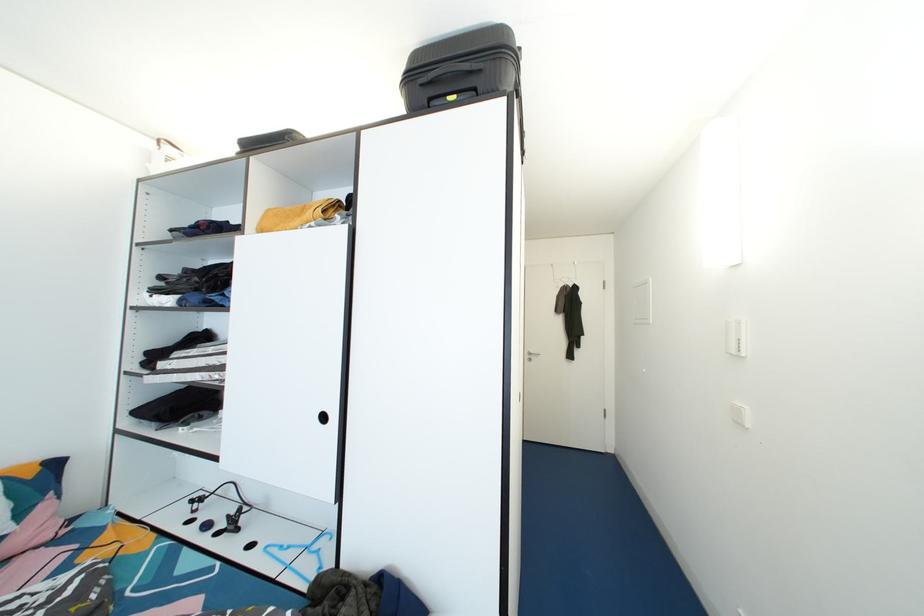
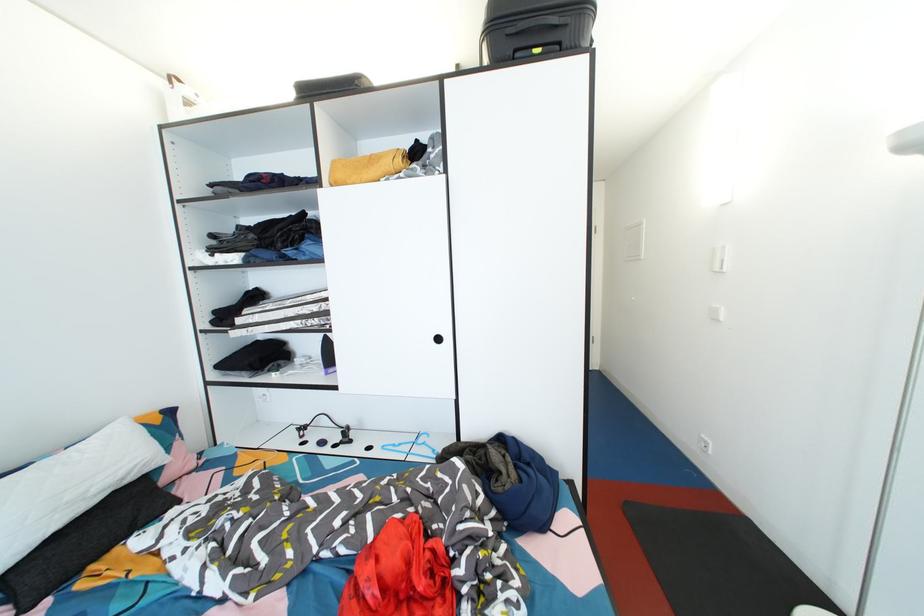
Find the pixel in the second image that matches the point at 295,553 in the first image.

(407, 450)